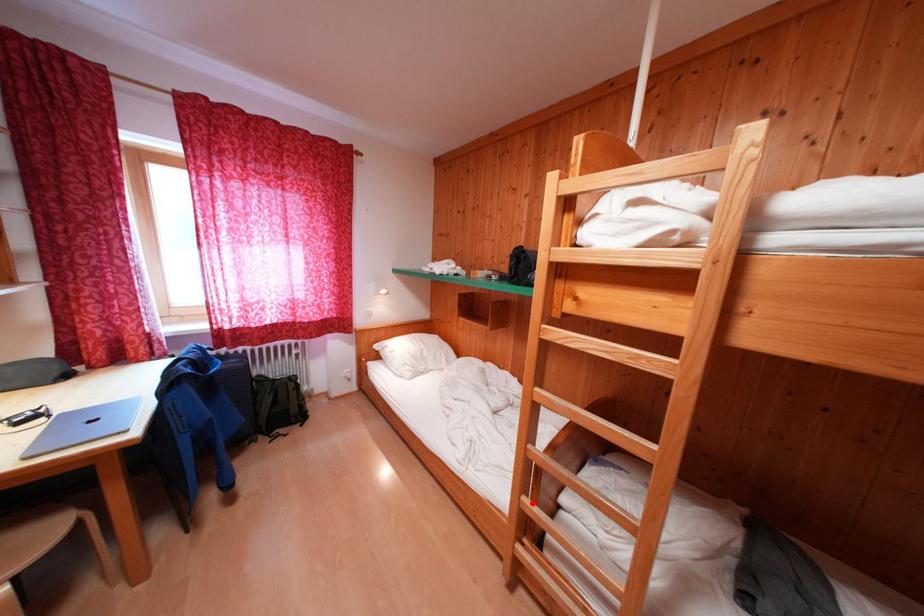
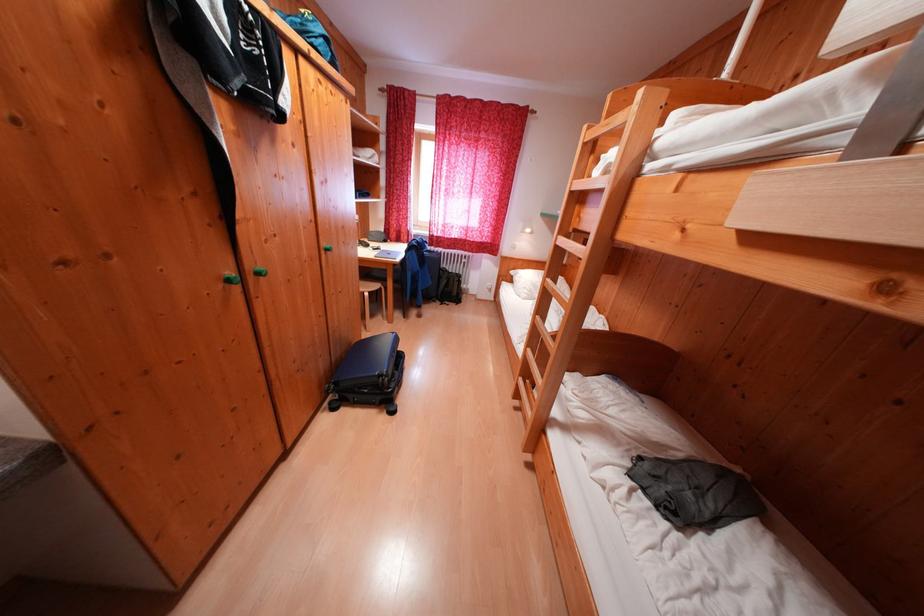
In the second image, find the point that corresponds to the highlighted location in the first image.

(537, 354)